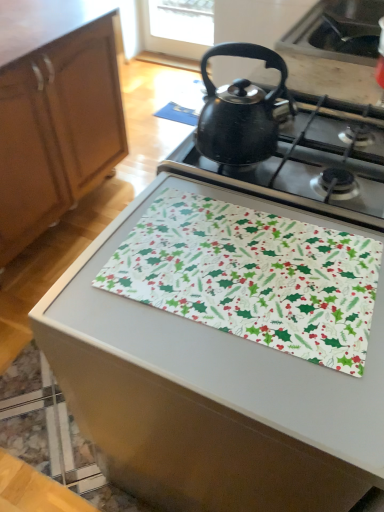
Question: From the image's perspective, is wooden cabinet at left located beneath white fabric placemat at center?

Choices:
 (A) no
 (B) yes

Answer: (A)

Question: Considering the relative sizes of wooden cabinet at left and white fabric placemat at center in the image provided, is wooden cabinet at left thinner than white fabric placemat at center?

Choices:
 (A) no
 (B) yes

Answer: (A)

Question: Does wooden cabinet at left have a smaller size compared to white fabric placemat at center?

Choices:
 (A) yes
 (B) no

Answer: (B)

Question: Would you say white fabric placemat at center is part of wooden cabinet at left's contents?

Choices:
 (A) yes
 (B) no

Answer: (B)

Question: Considering the relative positions of wooden cabinet at left and white fabric placemat at center in the image provided, is wooden cabinet at left to the right of white fabric placemat at center from the viewer's perspective?

Choices:
 (A) yes
 (B) no

Answer: (B)

Question: Is white fabric placemat at center at the back of wooden cabinet at left?

Choices:
 (A) no
 (B) yes

Answer: (B)

Question: Is white fabric with holiday pattern at center shorter than white fabric placemat at center?

Choices:
 (A) no
 (B) yes

Answer: (B)

Question: Is white fabric placemat at center located within white fabric with holiday pattern at center?

Choices:
 (A) no
 (B) yes

Answer: (A)

Question: From a real-world perspective, is white fabric with holiday pattern at center beneath white fabric placemat at center?

Choices:
 (A) no
 (B) yes

Answer: (A)

Question: Would you say white fabric with holiday pattern at center is outside white fabric placemat at center?

Choices:
 (A) no
 (B) yes

Answer: (A)

Question: Can you confirm if white fabric with holiday pattern at center is bigger than white fabric placemat at center?

Choices:
 (A) no
 (B) yes

Answer: (A)

Question: Can you confirm if white fabric with holiday pattern at center is wider than white fabric placemat at center?

Choices:
 (A) no
 (B) yes

Answer: (A)

Question: Is white fabric with holiday pattern at center positioned in front of black matte kettle at upper center?

Choices:
 (A) no
 (B) yes

Answer: (B)